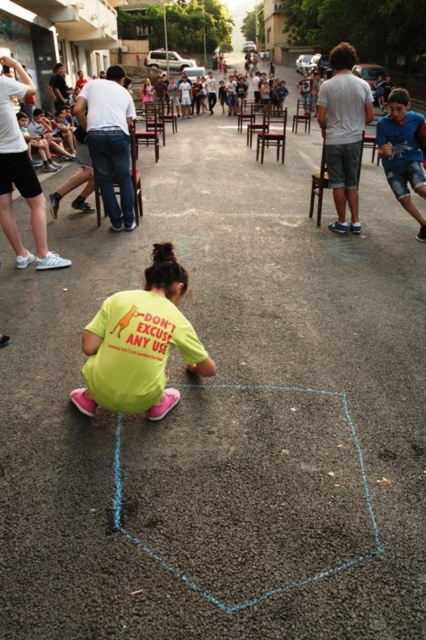
Question: Which object is farther from the camera taking this photo?

Choices:
 (A) yellow matte shirt at lower center
 (B) blue denim shorts at right

Answer: (B)

Question: Can you confirm if yellow matte shirt at lower center is positioned to the right of blue denim shorts at right?

Choices:
 (A) no
 (B) yes

Answer: (A)

Question: Is yellow matte shirt at lower center above blue denim shorts at right?

Choices:
 (A) no
 (B) yes

Answer: (A)

Question: Which point is farther to the camera?

Choices:
 (A) blue denim shorts at right
 (B) yellow matte shirt at lower center

Answer: (A)

Question: Which point is farther from the camera taking this photo?

Choices:
 (A) (423, 188)
 (B) (103, 305)

Answer: (A)

Question: Where is yellow matte shirt at lower center located in relation to blue denim shorts at right in the image?

Choices:
 (A) below
 (B) above

Answer: (A)